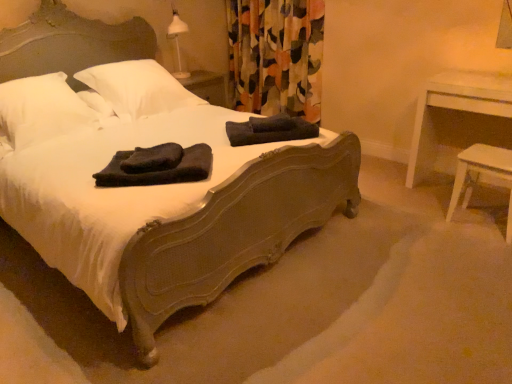
Question: Considering the relative positions of white soft pillow at upper left, the first pillow positioned from the left, and white wood stool at lower right in the image provided, is white soft pillow at upper left, the first pillow positioned from the left, in front of white wood stool at lower right?

Choices:
 (A) yes
 (B) no

Answer: (A)

Question: Considering the relative sizes of white soft pillow at upper left, the first pillow positioned from the left, and white wood stool at lower right in the image provided, is white soft pillow at upper left, the first pillow positioned from the left, taller than white wood stool at lower right?

Choices:
 (A) yes
 (B) no

Answer: (B)

Question: From a real-world perspective, is white soft pillow at upper left, acting as the second pillow starting from the right, physically above white wood stool at lower right?

Choices:
 (A) no
 (B) yes

Answer: (B)

Question: Could you tell me if white soft pillow at upper left, acting as the second pillow starting from the right, is facing white wood stool at lower right?

Choices:
 (A) no
 (B) yes

Answer: (A)

Question: Considering the relative sizes of white soft pillow at upper left, acting as the second pillow starting from the right, and white wood stool at lower right in the image provided, is white soft pillow at upper left, acting as the second pillow starting from the right, thinner than white wood stool at lower right?

Choices:
 (A) yes
 (B) no

Answer: (B)

Question: Is white wood stool at lower right at the back of white soft pillow at upper left, acting as the second pillow starting from the right?

Choices:
 (A) no
 (B) yes

Answer: (A)

Question: Is black towel at center, marked as the first material in a front-to-back arrangement, touching white soft pillow at upper left, the first pillow positioned from the left?

Choices:
 (A) yes
 (B) no

Answer: (B)

Question: Is black towel at center, marked as the first material in a front-to-back arrangement, facing away from white soft pillow at upper left, the first pillow positioned from the left?

Choices:
 (A) yes
 (B) no

Answer: (B)

Question: Are black towel at center, marked as the first material in a front-to-back arrangement, and white soft pillow at upper left, acting as the second pillow starting from the right, located far from each other?

Choices:
 (A) no
 (B) yes

Answer: (A)

Question: Can you confirm if black towel at center, marked as the first material in a front-to-back arrangement, is wider than white soft pillow at upper left, the first pillow positioned from the left?

Choices:
 (A) yes
 (B) no

Answer: (B)

Question: Is black towel at center, positioned as the second material in back-to-front order, at the right side of white soft pillow at upper left, the first pillow positioned from the left?

Choices:
 (A) no
 (B) yes

Answer: (B)

Question: Does black towel at center, marked as the first material in a front-to-back arrangement, lie behind white soft pillow at upper left, the first pillow positioned from the left?

Choices:
 (A) no
 (B) yes

Answer: (A)

Question: Is the position of matte dark wood bed at center more distant than that of white soft pillow at upper left, acting as the second pillow starting from the right?

Choices:
 (A) yes
 (B) no

Answer: (B)